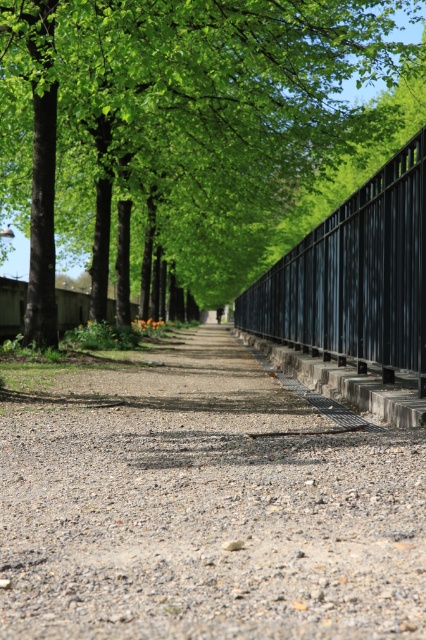
What do you see at coordinates (201, 500) in the screenshot? The image size is (426, 640). I see `gravelly dirt path at center` at bounding box center [201, 500].

Who is more forward, [81,568] or [5,173]?

Point [81,568]

What do you see at coordinates (201, 500) in the screenshot? This screenshot has height=640, width=426. I see `gravelly dirt path at center` at bounding box center [201, 500].

The width and height of the screenshot is (426, 640). Identify the location of gravelly dirt path at center. (201, 500).

Between green leafy tree at center and black metal fence at right, which one appears on the right side from the viewer's perspective?

green leafy tree at center is more to the right.

Can you confirm if green leafy tree at center is positioned to the right of black metal fence at right?

Indeed, green leafy tree at center is positioned on the right side of black metal fence at right.

Find the location of a particular element. This screenshot has height=640, width=426. green leafy tree at center is located at coordinates (189, 132).

Between point (51, 476) and point (354, 208), which one is positioned behind?

Positioned behind is point (354, 208).

The width and height of the screenshot is (426, 640). What do you see at coordinates (201, 500) in the screenshot?
I see `gravelly dirt path at center` at bounding box center [201, 500].

The image size is (426, 640). What are the coordinates of `gravelly dirt path at center` in the screenshot? It's located at (201, 500).